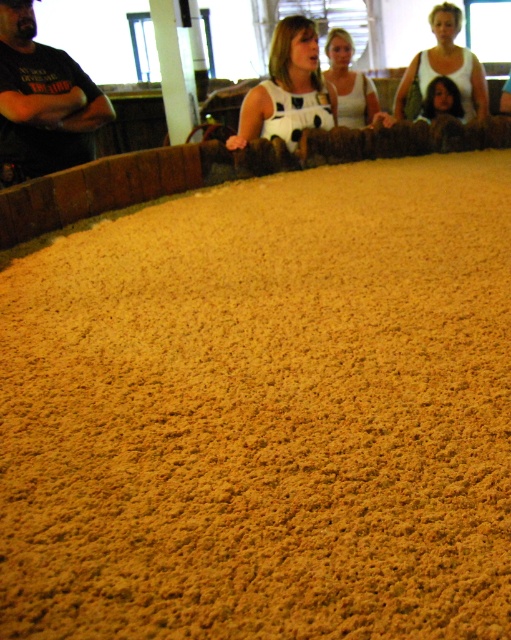
Question: Which object is positioned farthest from the white matte tank top at upper center?

Choices:
 (A) white dotted dress at center
 (B) white dotted dress at upper center
 (C) smooth brown hair at upper right

Answer: (C)

Question: Does white dotted dress at center have a smaller size compared to white matte tank top at upper center?

Choices:
 (A) no
 (B) yes

Answer: (A)

Question: Among these objects, which one is nearest to the camera?

Choices:
 (A) white dotted dress at upper center
 (B) white dotted dress at center
 (C) smooth brown hair at upper right

Answer: (B)

Question: Which point is farther to the camera?

Choices:
 (A) (429, 99)
 (B) (445, 45)
 (C) (341, 88)
 (D) (278, 28)

Answer: (C)

Question: Does white dotted dress at center lie behind white matte tank top at upper center?

Choices:
 (A) no
 (B) yes

Answer: (A)

Question: Where is white matte tank top at upper center located in relation to smooth brown hair at upper right in the image?

Choices:
 (A) above
 (B) below

Answer: (A)